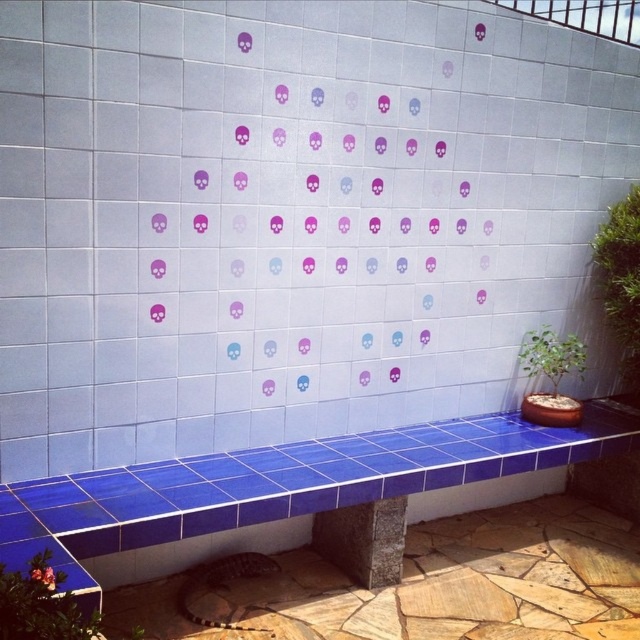
You are designing a garden layout and need to place a new decorative item. The blue ceramic bench at center and the green leafy plant at lower left are already in the scene. Which object should you consider for replacement if space is limited?

The green leafy plant at lower left should be considered for replacement because the blue ceramic bench at center is bigger and takes up more space, making the smaller plant a better candidate for removal if space is limited.

In the scene shown: You are a gardener looking to water the green leafy plant at lower left. You need to reach it without stepping on the blue ceramic bench at center. Can you do this?

The blue ceramic bench at center is above the green leafy plant at lower left, so you can reach the plant without stepping on the bench by approaching it from below.